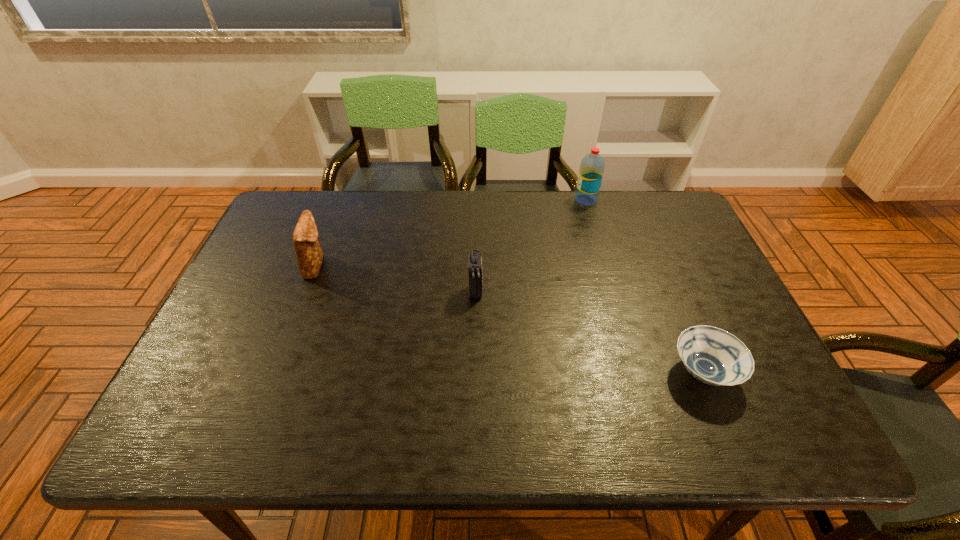
This screenshot has width=960, height=540. Identify the location of free space located 0.230m on the open side of the left clutch bag. [x=407, y=265].

At what (x,y) coordinates should I click in order to perform the action: click on free space located with the zip open on the second object from left to right. Please return your answer as a coordinate pair (x, y). The image size is (960, 540). Looking at the image, I should click on (475, 323).

You are a GUI agent. You are given a task and a screenshot of the screen. Output one action in this format:
    pyautogui.click(x=<x>, y=<y>)
    Task: Click on the vacant position located on the right of the nearest object
    Image resolution: width=960 pixels, height=540 pixels.
    Given the screenshot: What is the action you would take?
    pyautogui.click(x=773, y=372)

The image size is (960, 540). Identify the location of object at the far edge. (592, 166).

Locate an element on the screen. object at the right edge is located at coordinates pos(714,356).

Find the location of a particular element. free region at the far edge of the desktop is located at coordinates click(x=407, y=203).

The image size is (960, 540). Identify the location of vacant point at the near edge. (657, 408).

Find the location of a particular element. This screenshot has width=960, height=540. vacant space at the left edge of the desktop is located at coordinates (220, 394).

The image size is (960, 540). Identify the location of vacant space at the right edge of the desktop. (702, 296).

Where is `free space at the far left corner of the desktop`? free space at the far left corner of the desktop is located at coordinates (284, 224).